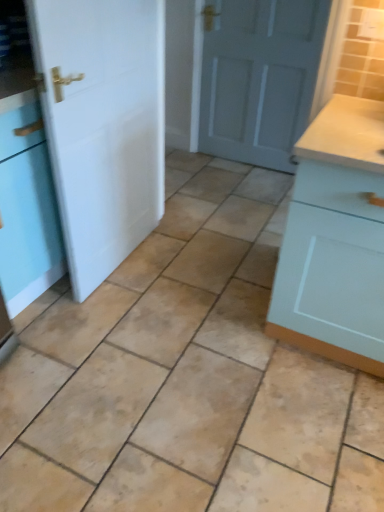
Locate an element on the screen. spots to the right of white matte door at left, acting as the second door starting from the back is located at coordinates (192, 273).